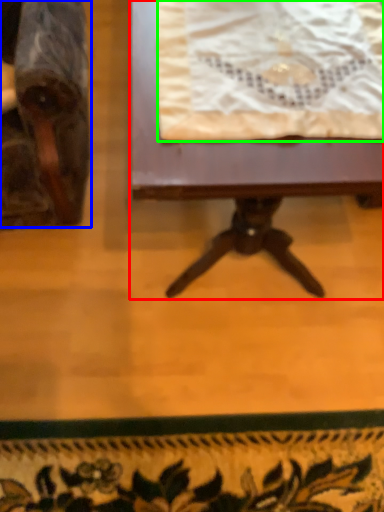
Question: Which object is the farthest from table (highlighted by a red box)? Choose among these: chair (highlighted by a blue box) or blanket (highlighted by a green box).

Choices:
 (A) chair
 (B) blanket

Answer: (A)